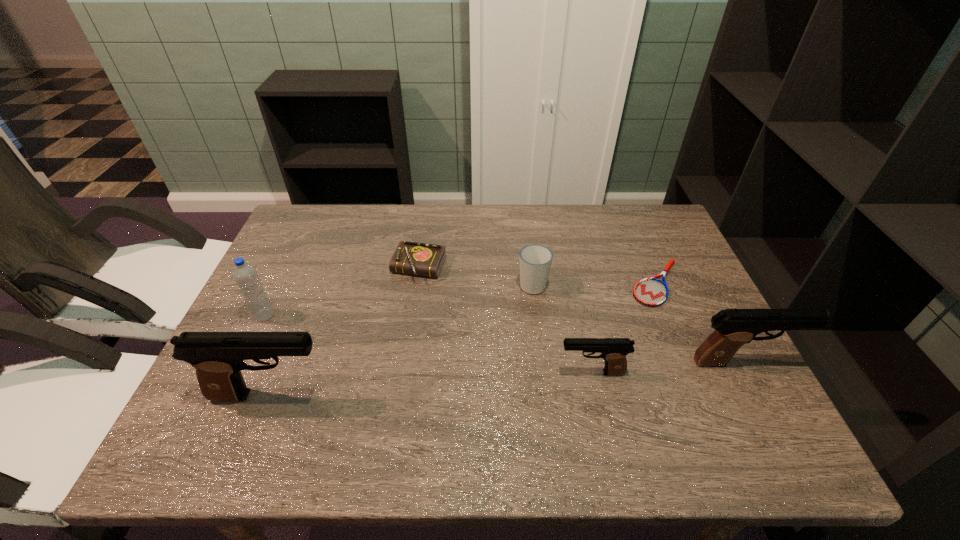
The height and width of the screenshot is (540, 960). I want to click on free space for an extra pistol to achieve even spacing, so click(x=434, y=383).